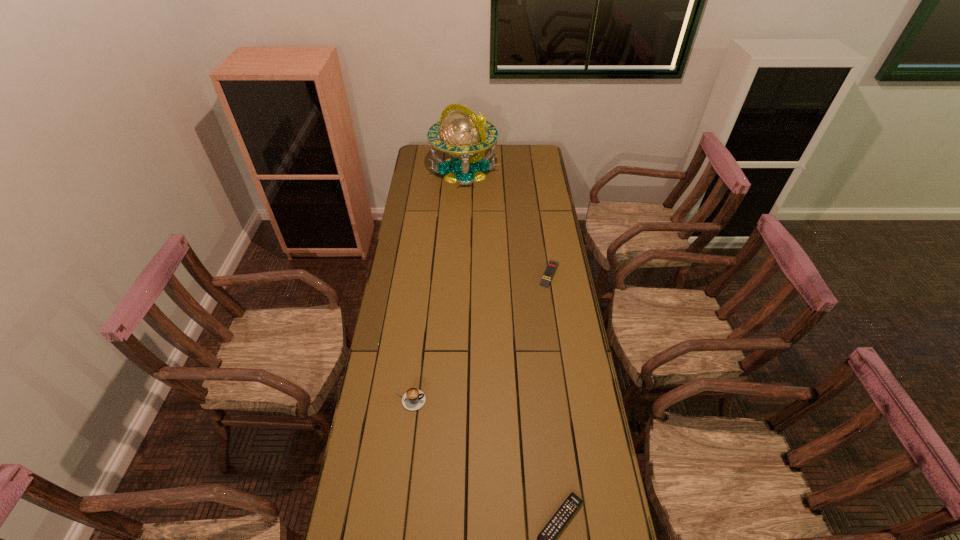
Find the location of a particular element. This screenshot has width=960, height=540. vacant space in between the tallest object and the second shortest object is located at coordinates (507, 222).

Image resolution: width=960 pixels, height=540 pixels. Identify the location of empty location between the taller remote control and the second tallest object. (479, 337).

Locate an element on the screen. vacant space in between the third shortest object and the third nearest object is located at coordinates (479, 337).

This screenshot has height=540, width=960. What are the coordinates of `object that is the closest one to the tallest object` in the screenshot? It's located at (552, 265).

Locate which object is the closest to the tallest object. Please provide its 2D coordinates. Your answer should be formatted as a tuple, i.e. [(x, y)], where the tuple contains the x and y coordinates of a point satisfying the conditions above.

[(552, 265)]

This screenshot has width=960, height=540. Identify the location of vacant region that satisfies the following two spatial constraints: 1. on the front side of the taller remote control; 2. with the handle on the side of the cappuccino. (569, 400).